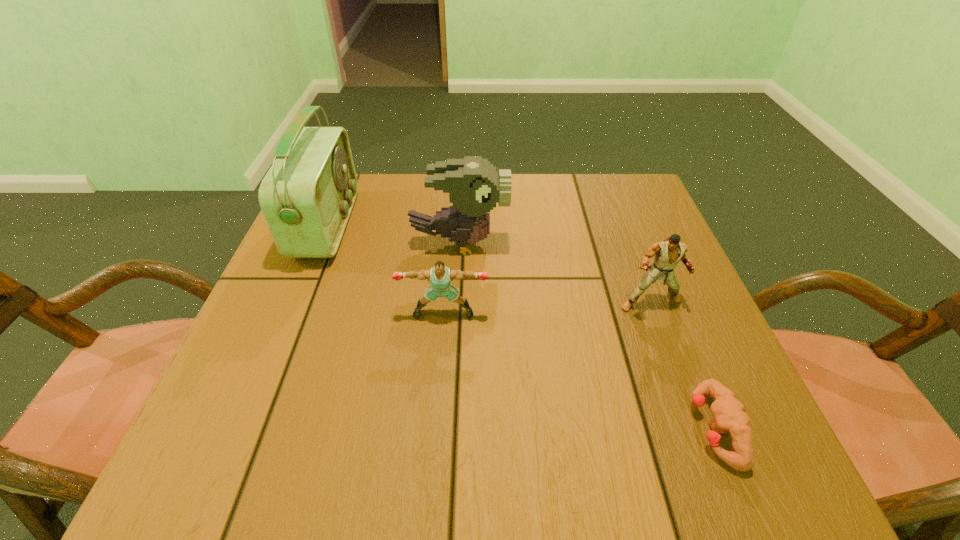
What are the coordinates of `the leftmost object` in the screenshot? It's located at (307, 196).

Locate an element on the screen. This screenshot has height=540, width=960. radio receiver is located at coordinates (307, 196).

Locate an element on the screen. Image resolution: width=960 pixels, height=540 pixels. bird is located at coordinates (474, 187).

Find the location of a particular element. This screenshot has height=540, width=960. the third shortest object is located at coordinates (669, 252).

The height and width of the screenshot is (540, 960). Find the location of `the leftmost puncher`. the leftmost puncher is located at coordinates (440, 276).

The width and height of the screenshot is (960, 540). In order to click on the second shortest puncher in this screenshot , I will do `click(440, 276)`.

You are a GUI agent. You are given a task and a screenshot of the screen. Output one action in this format:
    pyautogui.click(x=<x>, y=<y>)
    Task: Click on the shortest object
    This screenshot has width=960, height=540.
    Given the screenshot: What is the action you would take?
    pyautogui.click(x=728, y=413)

You are a GUI agent. You are given a task and a screenshot of the screen. Output one action in this format:
    pyautogui.click(x=<x>, y=<y>)
    Task: Click on the shortest puncher
    Image resolution: width=960 pixels, height=540 pixels.
    Given the screenshot: What is the action you would take?
    pyautogui.click(x=728, y=413)

The width and height of the screenshot is (960, 540). What are the coordinates of `free space located 0.130m on the front panel of the tallest object` in the screenshot? It's located at (405, 226).

Identify the location of vacant space situated at the beak of the bird. (608, 244).